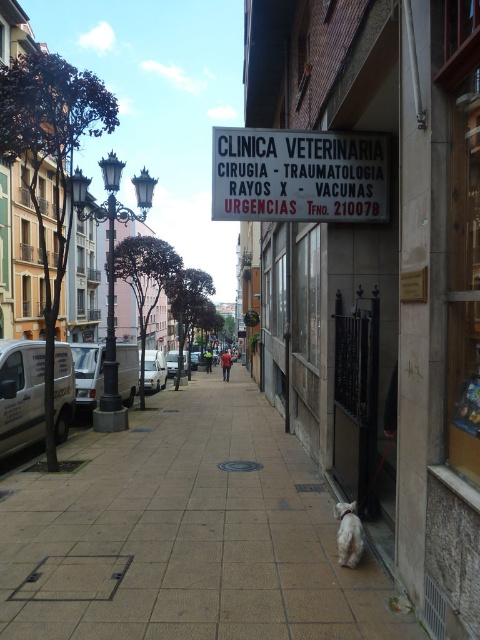
You are a delivery person who needs to park your 2.5 meter tall truck in this area. You see the white paper sign at center and the metallic silver van at left. Which object is taller, and can your truck fit under it?

The white paper sign at center is much taller than the metallic silver van at left. Since the truck is 2.5 meters tall, it can fit under the white paper sign at center as it is taller, but cannot fit under the metallic silver van at left which is shorter.

You are a delivery person who needs to park your white matte van at center in a spot that won t block the entrance of the veterinary clinic. The white fluffy dog at lower center is currently in the way. Can you move the dog to a different location so the van can park safely?

The white fluffy dog at lower center is positioned over the white matte van at center, so moving the dog would allow the van to park without blocking the entrance.

You are a delivery driver who needs to park your vehicle on the brown tile pavement at center. The parking spot requires vehicles to be aligned with the center point of the pavement. According to the image, is your vehicle currently positioned correctly?

The brown tile pavement at center is located at point (186, 534), so if your vehicle is parked at that coordinate, it is correctly aligned with the center point of the pavement.